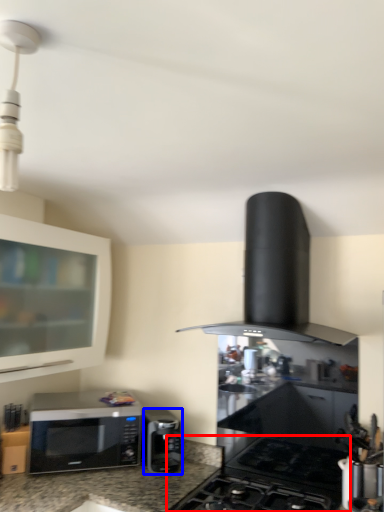
Question: Which point is further to the camera, gas stove (highlighted by a red box) or microwave oven (highlighted by a blue box)?

Choices:
 (A) gas stove
 (B) microwave oven

Answer: (B)